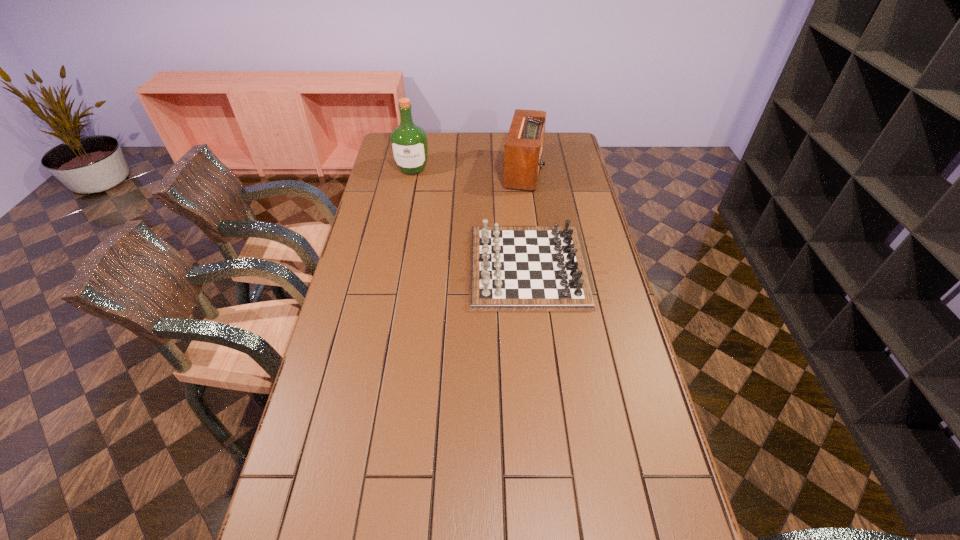
This screenshot has height=540, width=960. I want to click on object situated at the far edge, so click(523, 150).

Where is `object located at the left edge`? Image resolution: width=960 pixels, height=540 pixels. object located at the left edge is located at coordinates (409, 145).

Where is `radio receiver located at the right edge`? Image resolution: width=960 pixels, height=540 pixels. radio receiver located at the right edge is located at coordinates (523, 150).

Image resolution: width=960 pixels, height=540 pixels. I want to click on chessboard situated at the right edge, so click(512, 268).

Find the location of `object that is at the far right corner`. object that is at the far right corner is located at coordinates (523, 150).

Locate an element on the screen. This screenshot has width=960, height=540. vacant area at the far edge of the desktop is located at coordinates (494, 137).

In the image, there is a desktop. Identify the location of vacant space at the left edge. coord(342,291).

Image resolution: width=960 pixels, height=540 pixels. I want to click on free point at the right edge, so click(560, 165).

Locate an element on the screen. vacant space at the far right corner is located at coordinates (554, 157).

The image size is (960, 540). I want to click on vacant point located between the leftmost object and the shortest object, so click(x=470, y=218).